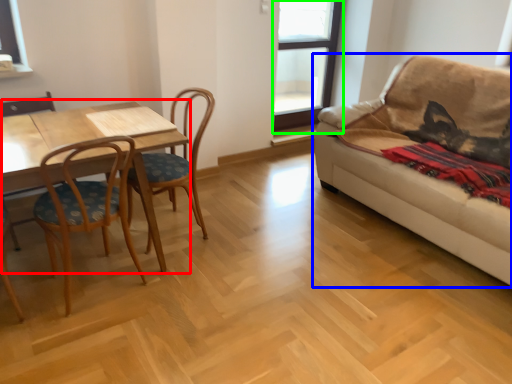
Question: Which object is positioned farthest from table (highlighted by a red box)? Select from studio couch (highlighted by a blue box) and window (highlighted by a green box).

Choices:
 (A) studio couch
 (B) window

Answer: (B)